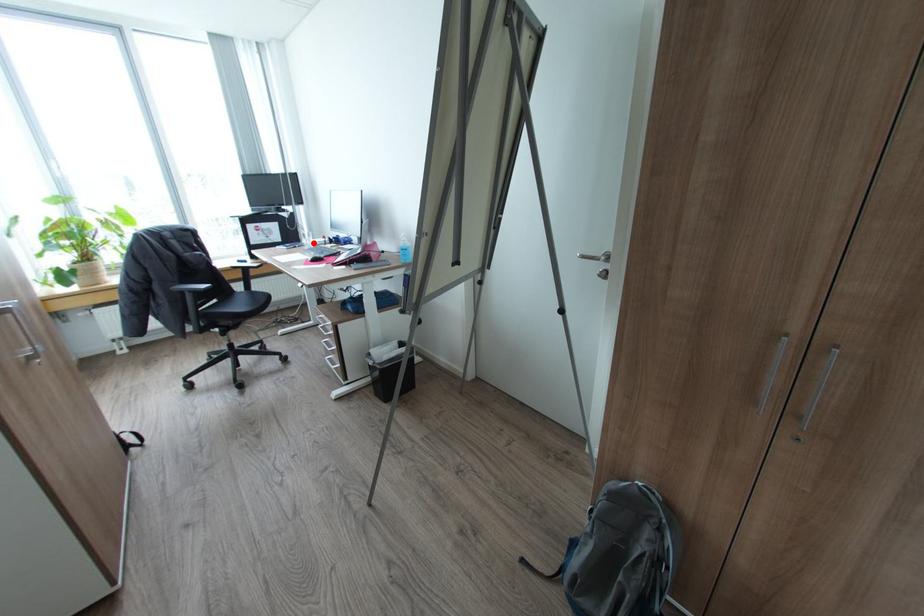
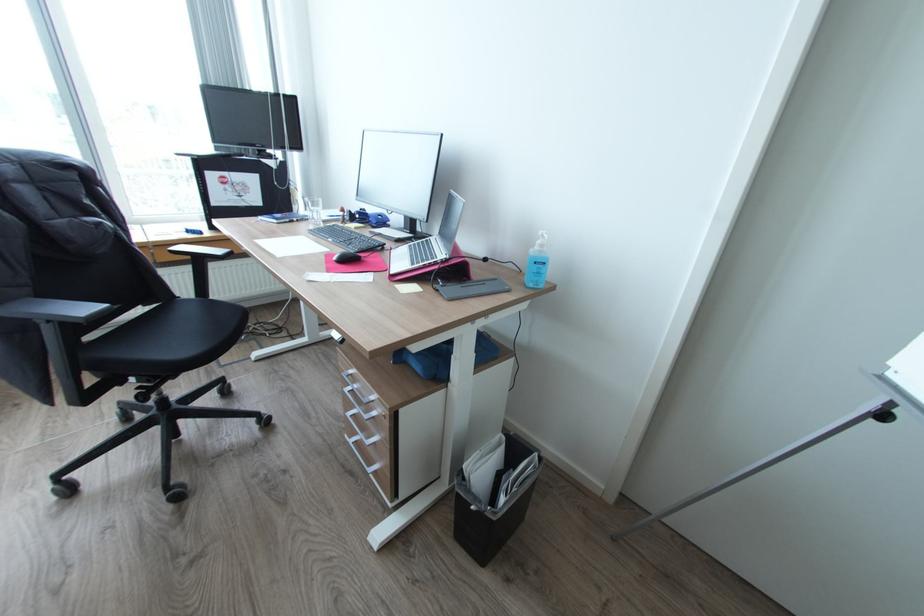
Find the pixel in the second image that matches the highlighted location in the first image.

(321, 217)